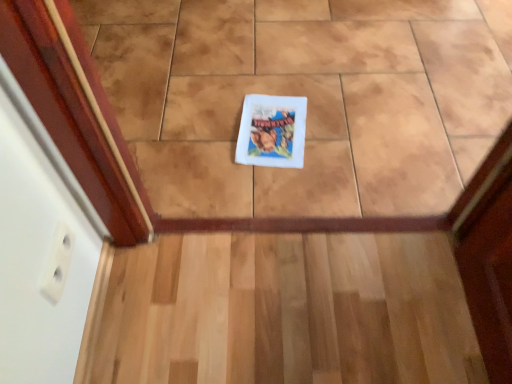
Identify the location of blank space situated above light wood stairs at center (from a real-world perspective). (306, 296).